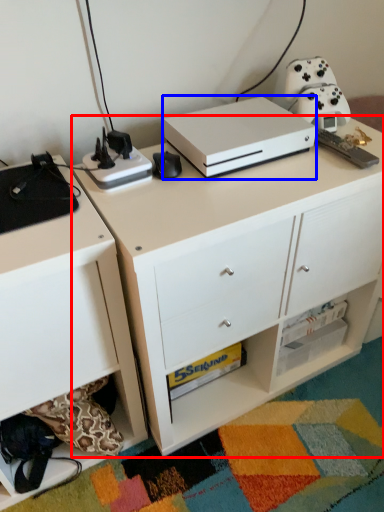
Question: Which of the following is the farthest to the observer, desk (highlighted by a red box) or appliance (highlighted by a blue box)?

Choices:
 (A) desk
 (B) appliance

Answer: (B)